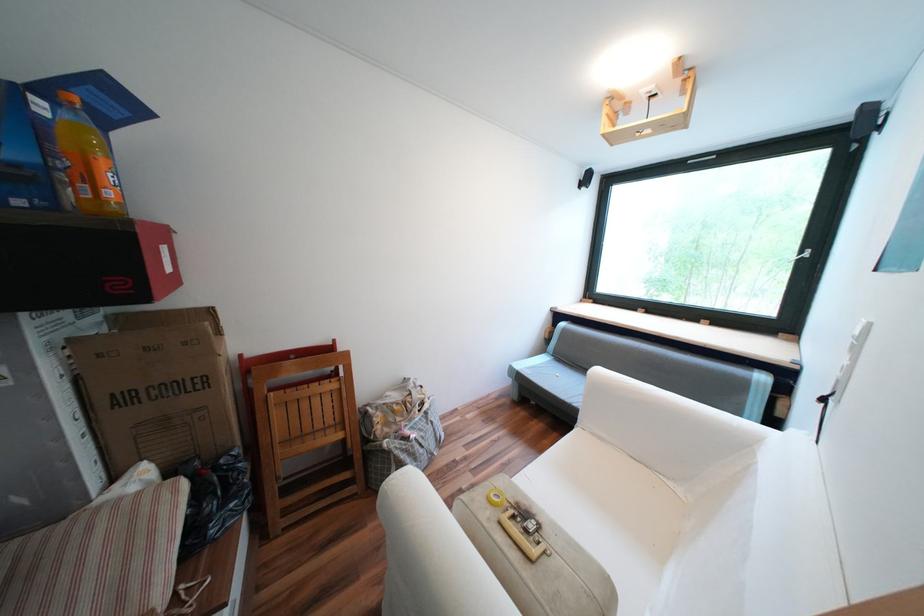
Which object does [495,496] point to?

This point indicates the yellow tape roll.